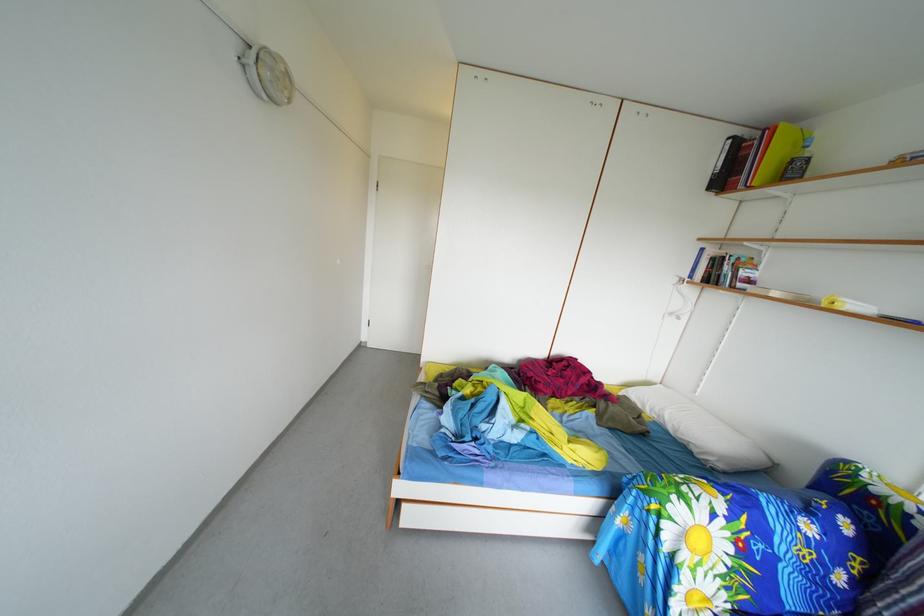
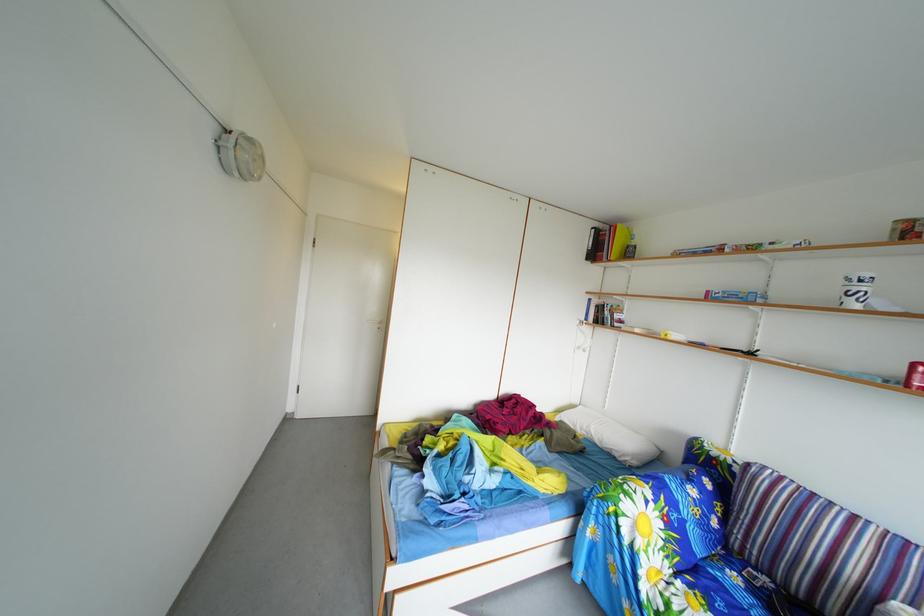
Question: The first image is from the beginning of the video and the second image is from the end. How did the camera likely rotate when shooting the video?

Choices:
 (A) Left
 (B) Right
 (C) Up
 (D) Down

Answer: (B)